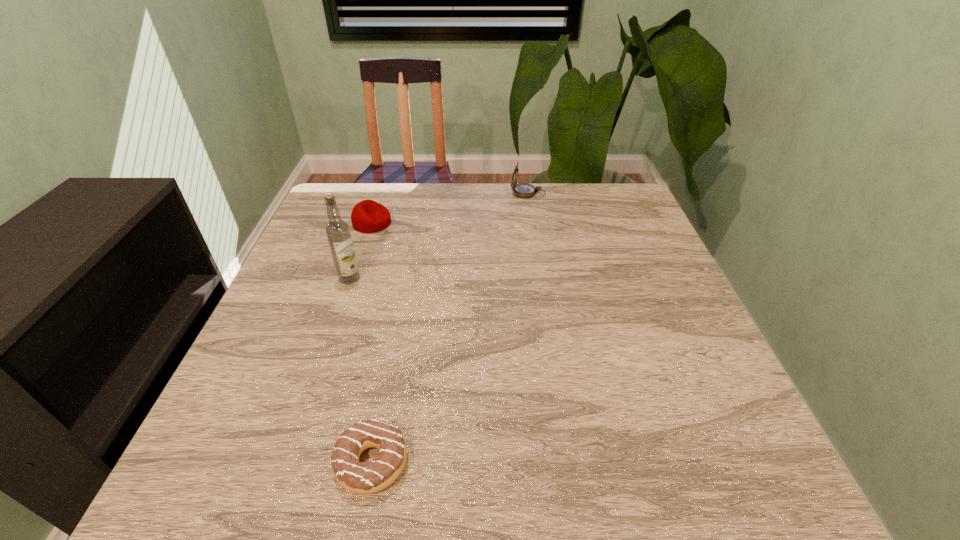
I want to click on vacant space at the far edge of the desktop, so click(x=558, y=184).

In the image, there is a desktop. At what (x,y) coordinates should I click in order to perform the action: click on vacant space at the near edge. Please return your answer as a coordinate pair (x, y). The image size is (960, 540). Looking at the image, I should click on (520, 462).

The image size is (960, 540). I want to click on vacant space at the left edge of the desktop, so click(305, 314).

In order to click on free point at the right edge in this screenshot , I will do `click(636, 245)`.

At what (x,y) coordinates should I click in order to perform the action: click on free location at the far right corner of the desktop. Please return your answer as a coordinate pair (x, y). Image resolution: width=960 pixels, height=540 pixels. Looking at the image, I should click on (644, 225).

Identify the location of vacant space that's between the second object from right to left and the vodka. This screenshot has height=540, width=960. (361, 370).

What are the coordinates of `free space between the tallest object and the nearest object` in the screenshot? It's located at (361, 370).

Find the location of a particular element. vacant area that lies between the second tallest object and the doughnut is located at coordinates (450, 328).

Identify the location of free space that is in between the rightmost object and the doughnut. click(450, 328).

Where is `vacant area between the third farthest object and the nearest object`? The image size is (960, 540). vacant area between the third farthest object and the nearest object is located at coordinates (361, 370).